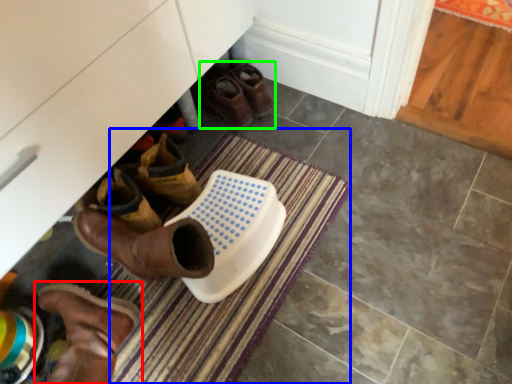
Question: Estimate the real-world distances between objects in this image. Which object is farther from footwear (highlighted by a red box), bath mat (highlighted by a blue box) or footwear (highlighted by a green box)?

Choices:
 (A) bath mat
 (B) footwear

Answer: (B)